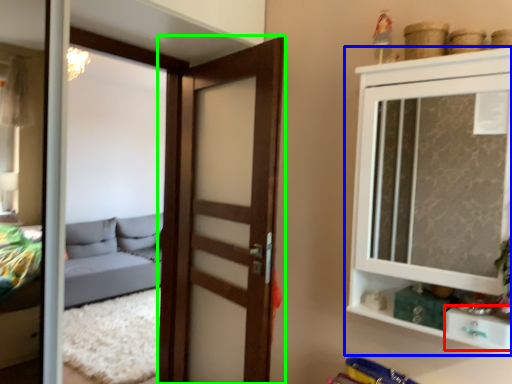
Question: Considering the real-world distances, which object is farthest from drawer (highlighted by a red box)? cupboard (highlighted by a blue box) or door (highlighted by a green box)?

Choices:
 (A) cupboard
 (B) door

Answer: (B)